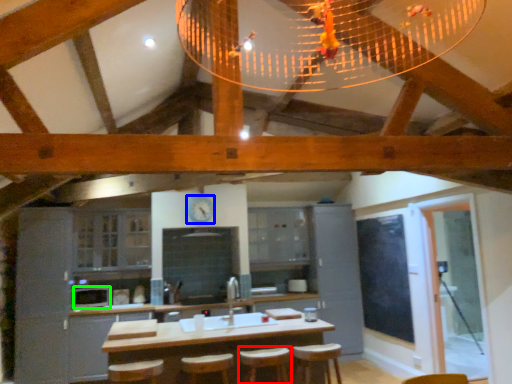
Question: Considering the real-world distances, which object is farthest from bar stool (highlighted by a red box)? clock (highlighted by a blue box) or appliance (highlighted by a green box)?

Choices:
 (A) clock
 (B) appliance

Answer: (B)